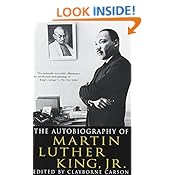
What are the coordinates of `book, notebooks` in the screenshot? It's located at (76, 123), (76, 119), (76, 114).